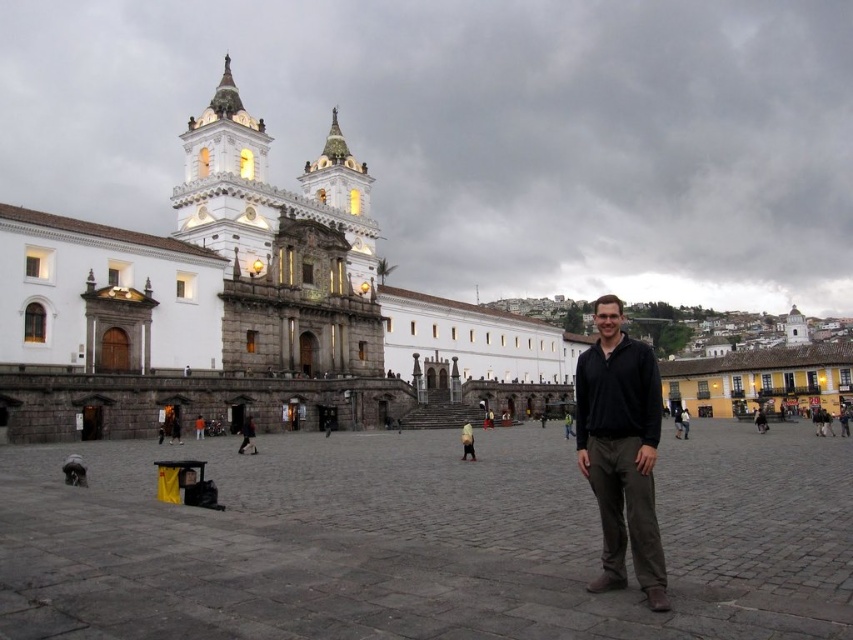
Question: Does white stone church at center appear over dark brown leather jacket at center?

Choices:
 (A) yes
 (B) no

Answer: (A)

Question: Can you confirm if white stone church at center is wider than dark brown leather jacket at center?

Choices:
 (A) yes
 (B) no

Answer: (A)

Question: Where is black matte shirt at center located in relation to dark brown leather jacket at center in the image?

Choices:
 (A) below
 (B) above

Answer: (B)

Question: Among these objects, which one is farthest from the camera?

Choices:
 (A) white stone church at center
 (B) dark brown leather jacket at center
 (C) black matte shirt at center

Answer: (B)

Question: Estimate the real-world distances between objects in this image. Which object is farther from the white stone church at center?

Choices:
 (A) black matte shirt at center
 (B) dark brown leather jacket at center

Answer: (A)

Question: Which object is closer to the camera taking this photo?

Choices:
 (A) black matte shirt at center
 (B) dark brown leather jacket at center
 (C) white stone church at center

Answer: (A)